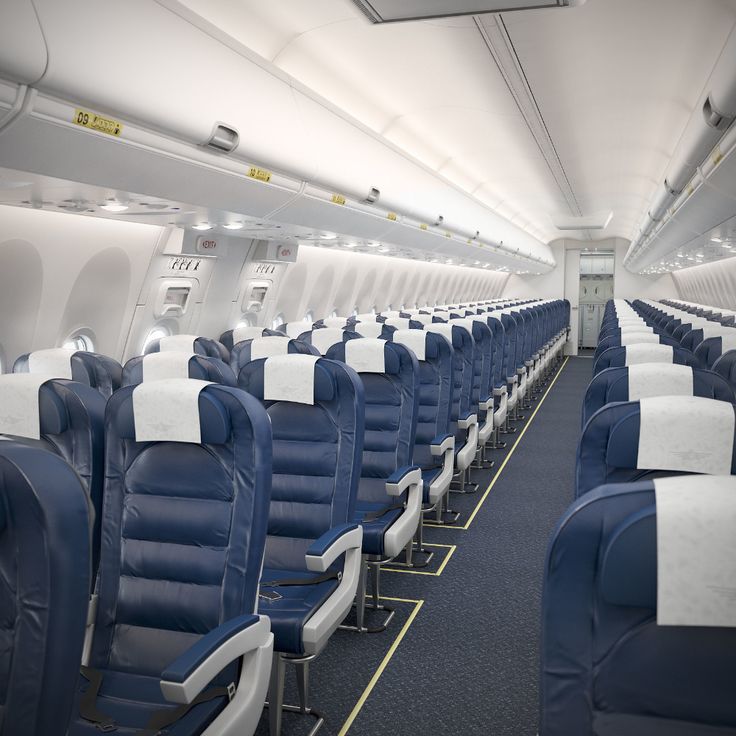
The height and width of the screenshot is (736, 736). Find the location of `arm rests`. arm rests is located at coordinates (216, 656), (333, 547), (406, 481), (442, 441), (470, 420), (489, 399), (503, 386), (513, 380), (525, 369).